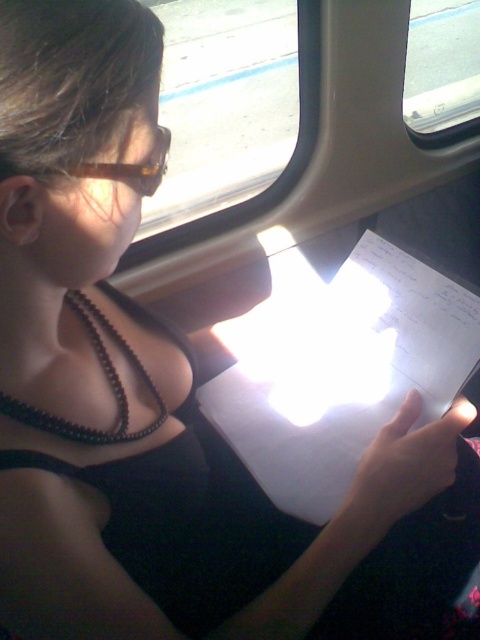
You are a passenger on a bus and want to read the text on the white paper at center. The black beaded necklace at center is blocking some light. Can you move the paper to the left to reduce glare from the window?

The white paper at center is currently to the right of the black beaded necklace at center. Moving it to the left might position it away from the window glare, but since the paper is already at the center, its position relative to the window isn

You are a passenger in a vehicle and want to read the white paper at center. Can you move the paper closer to the window to reduce glare?

The white paper at center is already positioned at point [338,371], which is the center of the vehicle. Moving it closer to the window might increase the glare since the sunlight is coming through the window. However, the exact effect depends on the window position and sunlight angle, which are not specified here.